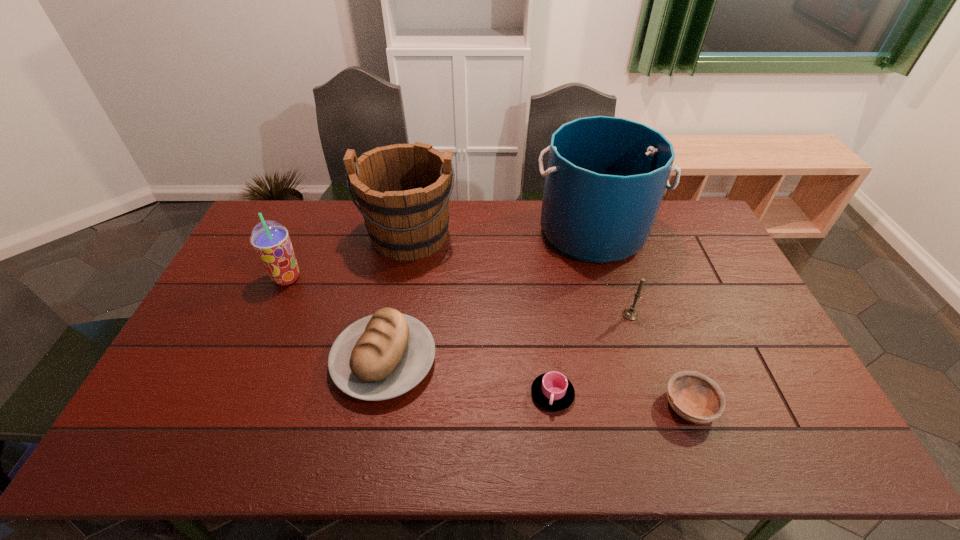
Locate an element on the screen. This screenshot has height=540, width=960. vacant space located 0.100m on the back of the leftmost object is located at coordinates (300, 247).

At what (x,y) coordinates should I click in order to perform the action: click on free spot located 0.370m on the left of the candle. Please return your answer as a coordinate pair (x, y). The width and height of the screenshot is (960, 540). Looking at the image, I should click on (499, 315).

The height and width of the screenshot is (540, 960). What are the coordinates of `free space located on the back of the bread` in the screenshot? It's located at click(401, 269).

Where is `vacant space located on the side with the handle of the cup`? The width and height of the screenshot is (960, 540). vacant space located on the side with the handle of the cup is located at coordinates (561, 458).

You are a GUI agent. You are given a task and a screenshot of the screen. Output one action in this format:
    pyautogui.click(x=<x>, y=<y>)
    Task: Click on the free space located on the right of the bowl
    The height and width of the screenshot is (540, 960).
    Given the screenshot: What is the action you would take?
    pyautogui.click(x=760, y=405)

I want to click on bucket that is at the far edge, so click(x=606, y=176).

This screenshot has width=960, height=540. In order to click on wine bucket at the far edge in this screenshot , I will do `click(403, 190)`.

This screenshot has height=540, width=960. I want to click on object that is at the near edge, so click(695, 397).

This screenshot has width=960, height=540. In order to click on object that is at the left edge in this screenshot , I will do `click(271, 241)`.

This screenshot has width=960, height=540. I want to click on free space at the far edge, so click(522, 237).